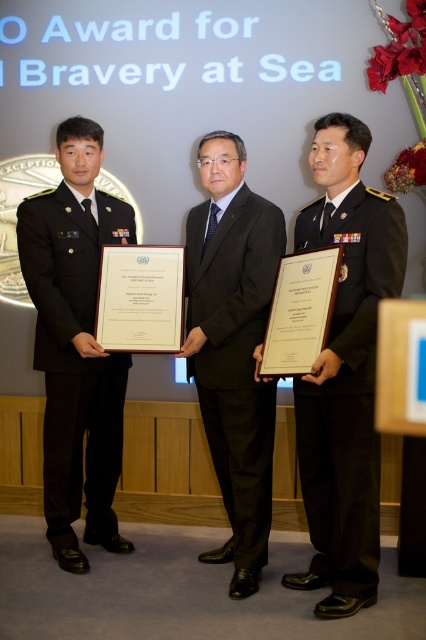
You are a photographer at the event and need to position a spotlight exactly at point (347, 394). Which individual will be illuminated by this spotlight?

The point (347, 394) corresponds to the dark green uniform at center, so the spotlight will illuminate the dark green uniform at center.

You are organizing a group photo for the event and need to ensure that the two individuals in black uniforms are positioned such that their widths are accommodated properly. Given that the black uniform at left is wider than the black uniform at center, which individual should be placed closer to the camera to avoid appearing too cramped?

The black uniform at left should be placed closer to the camera because it is wider than the black uniform at center, allowing it to occupy more space without appearing cramped.

You are standing at the origin point in the image. Which direction should you move to reach the dark green uniform at center?

The dark green uniform at center is located at point 0.616 on the x axis and 0.815 on the y axis. Since you are at the origin point, you should move towards the right and upwards to reach it.